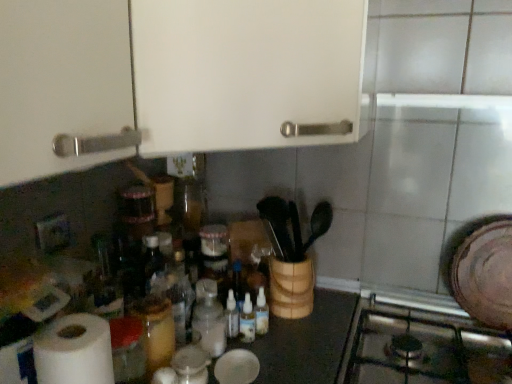
Question: Is there a large distance between translucent plastic bottles at center, which ranks as the 4th bottle in left-to-right order, and translucent glass jar at center, positioned as the fourth bottle in right-to-left order?

Choices:
 (A) yes
 (B) no

Answer: (B)

Question: From a real-world perspective, is translucent plastic bottles at center, which ranks as the 4th bottle in left-to-right order, located higher than translucent glass jar at center, positioned as the fourth bottle in right-to-left order?

Choices:
 (A) yes
 (B) no

Answer: (B)

Question: From the image's perspective, is translucent plastic bottles at center, arranged as the first bottle when viewed from the right, on translucent glass jar at center, arranged as the 1th bottle when viewed from the left?

Choices:
 (A) yes
 (B) no

Answer: (A)

Question: Does translucent plastic bottles at center, arranged as the first bottle when viewed from the right, come behind translucent glass jar at center, arranged as the 1th bottle when viewed from the left?

Choices:
 (A) yes
 (B) no

Answer: (A)

Question: Considering the relative sizes of translucent plastic bottles at center, which ranks as the 4th bottle in left-to-right order, and translucent glass jar at center, positioned as the fourth bottle in right-to-left order, in the image provided, is translucent plastic bottles at center, which ranks as the 4th bottle in left-to-right order, bigger than translucent glass jar at center, positioned as the fourth bottle in right-to-left order,?

Choices:
 (A) yes
 (B) no

Answer: (B)

Question: In the image, is translucent glass jar at center, positioned as the fourth bottle in right-to-left order, on the left side or the right side of translucent plastic bottles at center, which appears as the 2th bottle when viewed from the right?

Choices:
 (A) right
 (B) left

Answer: (B)

Question: From the image's perspective, is translucent glass jar at center, positioned as the fourth bottle in right-to-left order, positioned above or below translucent plastic bottles at center, which appears as the 2th bottle when viewed from the right?

Choices:
 (A) below
 (B) above

Answer: (B)

Question: Considering the positions of translucent glass jar at center, arranged as the 1th bottle when viewed from the left, and translucent plastic bottles at center, which appears as the 2th bottle when viewed from the right, in the image, is translucent glass jar at center, arranged as the 1th bottle when viewed from the left, wider or thinner than translucent plastic bottles at center, which appears as the 2th bottle when viewed from the right,?

Choices:
 (A) thin
 (B) wide

Answer: (B)

Question: Is point (139, 299) closer or farther from the camera than point (251, 304)?

Choices:
 (A) closer
 (B) farther

Answer: (A)

Question: Is translucent glass jar at center, positioned as the fourth bottle in right-to-left order, inside or outside of translucent plastic bottle at center, which is the third bottle from right to left?

Choices:
 (A) inside
 (B) outside

Answer: (B)

Question: Is point (140, 301) closer or farther from the camera than point (197, 327)?

Choices:
 (A) closer
 (B) farther

Answer: (A)

Question: In terms of height, does translucent glass jar at center, arranged as the 1th bottle when viewed from the left, look taller or shorter compared to translucent plastic bottle at center, which is the third bottle from right to left?

Choices:
 (A) short
 (B) tall

Answer: (A)

Question: In terms of width, does translucent glass jar at center, arranged as the 1th bottle when viewed from the left, look wider or thinner when compared to translucent plastic bottle at center, which is the third bottle from right to left?

Choices:
 (A) wide
 (B) thin

Answer: (A)

Question: Relative to translucent glass jar at center, arranged as the 1th bottle when viewed from the left, is translucent plastic bottle at center, the second bottle in the left-to-right sequence, in front or behind?

Choices:
 (A) behind
 (B) front

Answer: (A)

Question: Based on their positions, is translucent plastic bottle at center, the second bottle in the left-to-right sequence, located to the left or right of translucent glass jar at center, arranged as the 1th bottle when viewed from the left?

Choices:
 (A) right
 (B) left

Answer: (A)